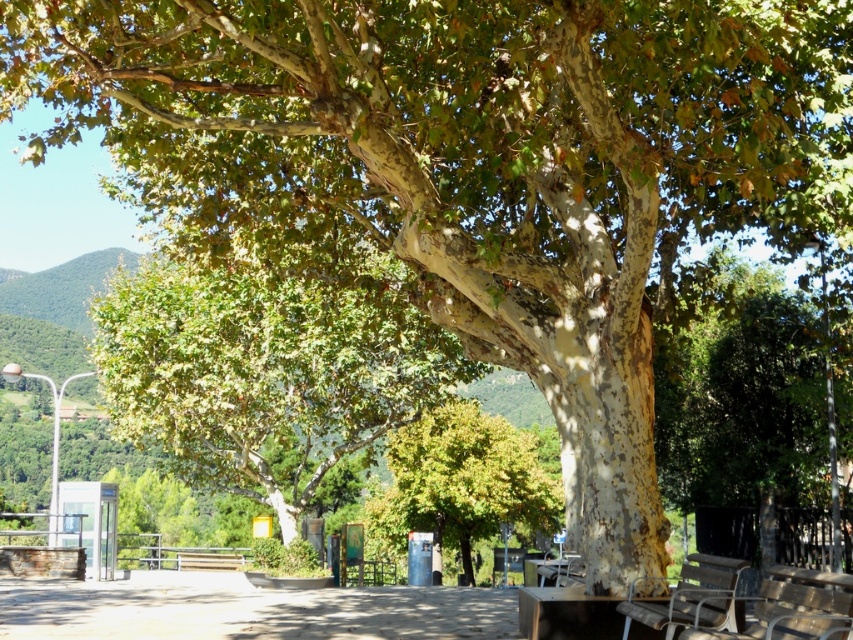
Question: Which of these objects is positioned closest to the green rough bark tree at center?

Choices:
 (A) wooden bench at lower right
 (B) metallic silver bench at lower right

Answer: (A)

Question: From the image, what is the correct spatial relationship of green rough bark tree at center in relation to wooden bench at lower right?

Choices:
 (A) right
 (B) left

Answer: (B)

Question: Which of the following is the farthest from the observer?

Choices:
 (A) green rough bark tree at center
 (B) green leafy tree at center
 (C) wooden bench at lower right
 (D) metallic silver bench at lower right

Answer: (B)

Question: Is green rough bark tree at center above metallic silver bench at lower right?

Choices:
 (A) yes
 (B) no

Answer: (A)

Question: Does green leafy tree at center have a greater width compared to metallic silver bench at lower right?

Choices:
 (A) yes
 (B) no

Answer: (A)

Question: Which point is closer to the camera taking this photo?

Choices:
 (A) tap(695, 556)
 (B) tap(521, 512)

Answer: (A)